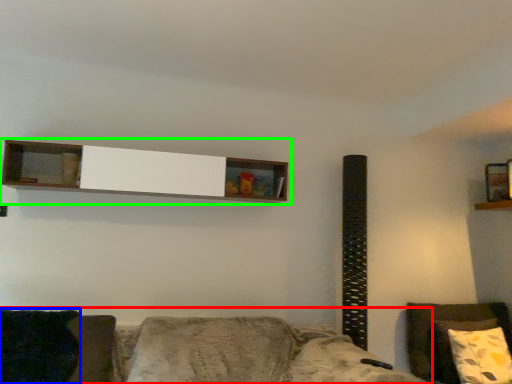
Question: Which object is the closest to the studio couch (highlighted by a red box)? Choose among these: pillow (highlighted by a blue box) or shelf (highlighted by a green box).

Choices:
 (A) pillow
 (B) shelf

Answer: (A)